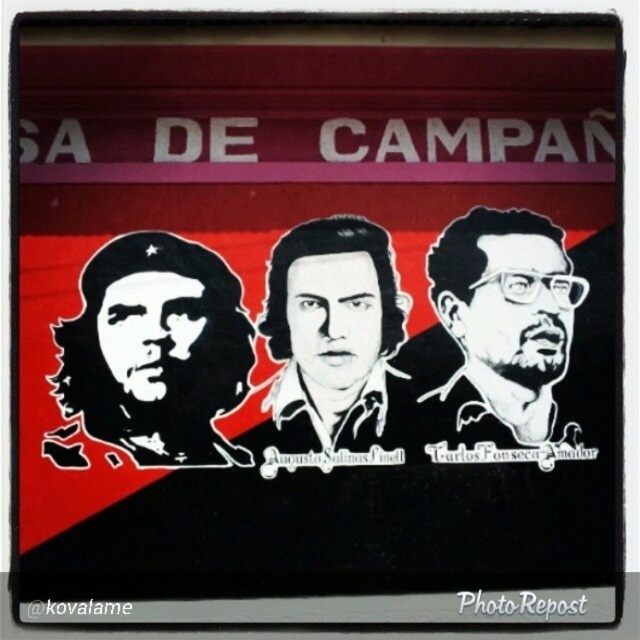
Is black matte portrait at left wider than black matte portrait at center?

Yes, black matte portrait at left is wider than black matte portrait at center.

Is black matte portrait at left taller than black matte portrait at center?

No, black matte portrait at left is not taller than black matte portrait at center.

Which is in front, point (129, 244) or point (323, 220)?

Point (129, 244) is more forward.

Where is `black matte portrait at left`? black matte portrait at left is located at coordinates tap(156, 349).

Is black matte portrait at left further to camera compared to black ink portrait at right?

No, it is in front of black ink portrait at right.

Which is more to the right, black matte portrait at left or black ink portrait at right?

From the viewer's perspective, black ink portrait at right appears more on the right side.

Find the location of a particular element. The height and width of the screenshot is (640, 640). black matte portrait at left is located at coordinates (156, 349).

Is black ink portrait at right to the left of black matte portrait at center from the viewer's perspective?

Incorrect, black ink portrait at right is not on the left side of black matte portrait at center.

At what (x,y) coordinates should I click in order to perform the action: click on black ink portrait at right. Please return your answer as a coordinate pair (x, y). Looking at the image, I should click on (496, 328).